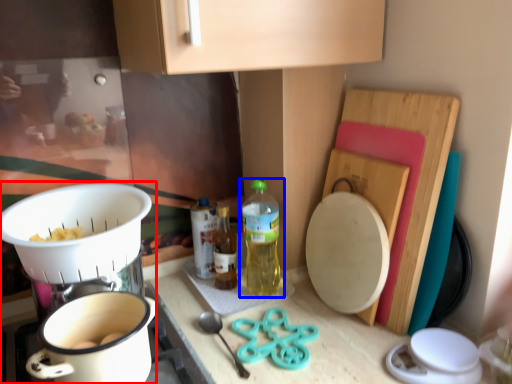
Question: Which object is further to the camera taking this photo, appliance (highlighted by a red box) or bottle (highlighted by a blue box)?

Choices:
 (A) appliance
 (B) bottle

Answer: (B)